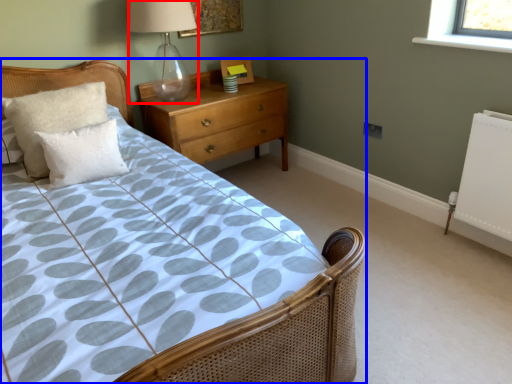
Question: Among these objects, which one is farthest to the camera, table lamp (highlighted by a red box) or bed (highlighted by a blue box)?

Choices:
 (A) table lamp
 (B) bed

Answer: (A)